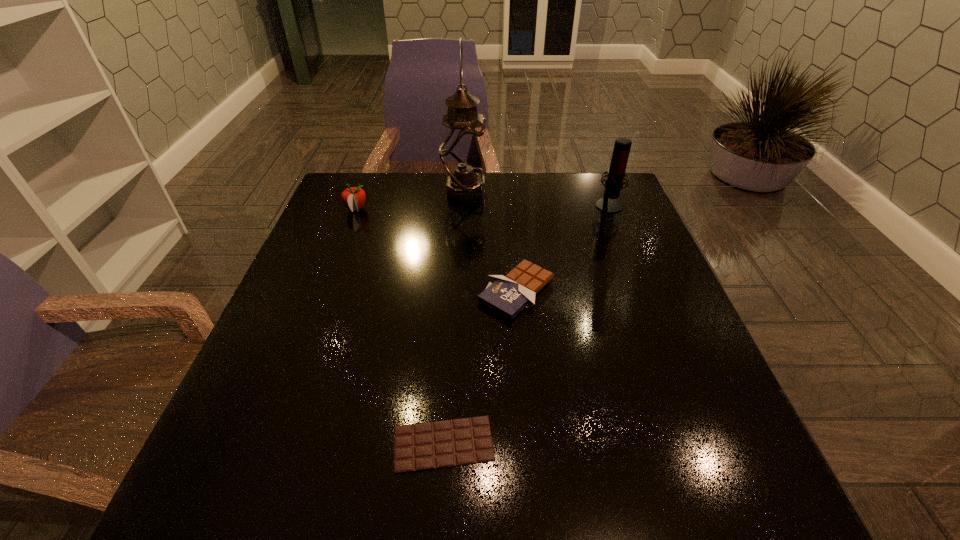
Find the location of `free space located 0.310m on the left of the rightmost object`. free space located 0.310m on the left of the rightmost object is located at coordinates (487, 204).

The image size is (960, 540). I want to click on free space located on the left of the leftmost object, so 324,210.

At what (x,y) coordinates should I click in order to perform the action: click on free space located 0.070m on the back of the second nearest object. Please return your answer as a coordinate pair (x, y). The image size is (960, 540). Looking at the image, I should click on [513, 246].

The width and height of the screenshot is (960, 540). Find the location of `free space located 0.290m on the right of the nearer chocolate bar`. free space located 0.290m on the right of the nearer chocolate bar is located at coordinates (671, 444).

Find the location of a particular element. This screenshot has width=960, height=540. oil lamp that is at the far edge is located at coordinates (462, 152).

Locate an element on the screen. microphone present at the far edge is located at coordinates (616, 173).

You are a GUI agent. You are given a task and a screenshot of the screen. Output one action in this format:
    pyautogui.click(x=<x>, y=<y>)
    Task: Click on the apple located at the far edge
    
    Given the screenshot: What is the action you would take?
    pyautogui.click(x=353, y=198)

Locate an element on the screen. object that is at the near edge is located at coordinates (440, 444).

Find the location of a particular element. object present at the left edge is located at coordinates (353, 198).

I want to click on object present at the right edge, so click(616, 173).